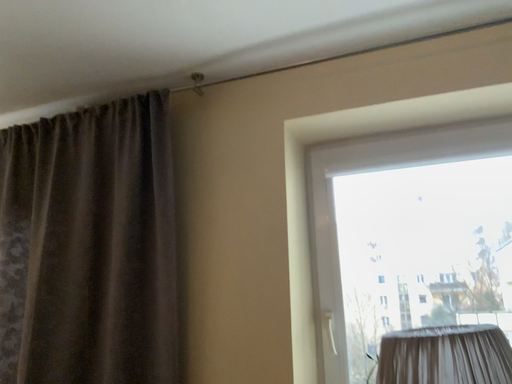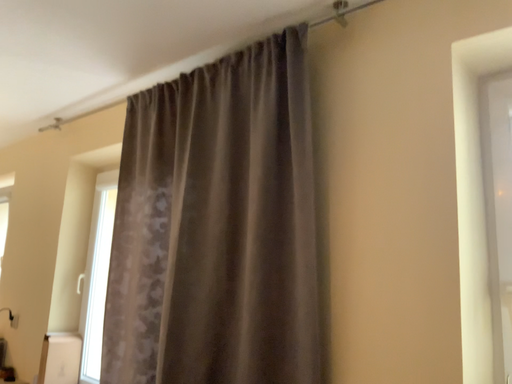
Question: Which way did the camera rotate in the video?

Choices:
 (A) rotated left
 (B) rotated right

Answer: (A)